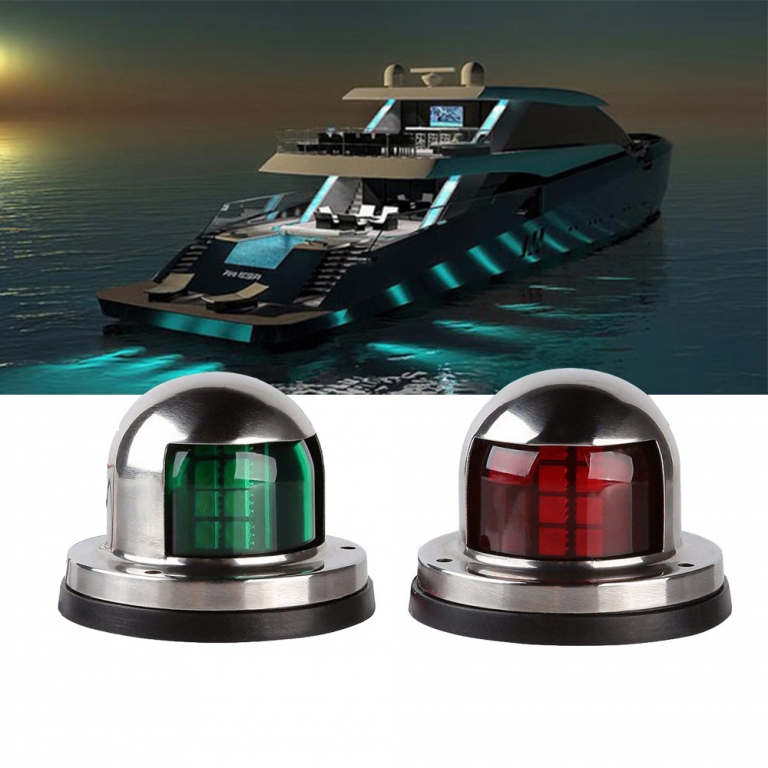
The height and width of the screenshot is (768, 768). What are the coordinates of `chair` in the screenshot? It's located at (233, 292).